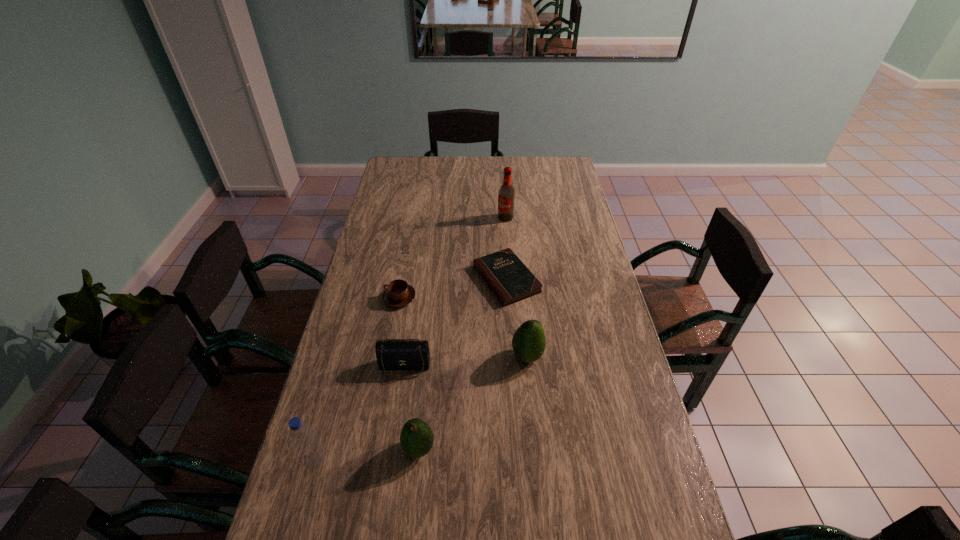
The height and width of the screenshot is (540, 960). What are the coordinates of `bottle` in the screenshot? It's located at (311, 454).

Where is `blank space located on the right of the left avocado`? This screenshot has width=960, height=540. blank space located on the right of the left avocado is located at coordinates (459, 449).

You are a GUI agent. You are given a task and a screenshot of the screen. Output one action in this format:
    pyautogui.click(x=<x>, y=<y>)
    Task: Click on the vacant space positioned on the front of the farther avocado
    Image resolution: width=960 pixels, height=540 pixels.
    Given the screenshot: What is the action you would take?
    pyautogui.click(x=535, y=434)

In order to click on free space located on the right of the tallest object in this screenshot , I will do `click(582, 218)`.

In order to click on vacant region located on the side of the sixth tallest object with the handle in this screenshot , I will do 366,298.

The image size is (960, 540). I want to click on free region located 0.070m on the side of the sixth tallest object with the handle, so click(363, 298).

Image resolution: width=960 pixels, height=540 pixels. Find the location of `vacant region located on the left of the Bible`. vacant region located on the left of the Bible is located at coordinates (370, 279).

I want to click on vacant space located 0.340m on the front flap of the clutch bag, so tap(384, 504).

Locate an element on the screen. vacant space situated on the right of the bottle is located at coordinates (350, 461).

Identify the location of cappuccino at the left edge. (398, 293).